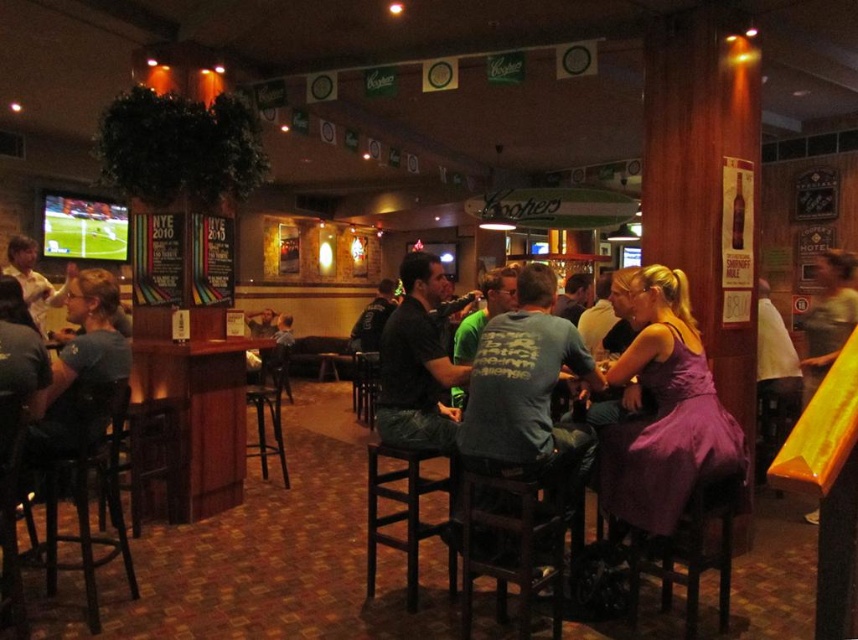
You are standing at the entrance of the bar and want to order a drink. The bartender is at the bar counter. Which direction should you walk to reach the bar counter? The objects you can see are the dark gray shirt at center represented by point (418, 362). Please answer based on the coordinate system where the entrance is at the bottom left corner of the image, and the coordinates are normalized between 0 and 1 in both x and y axes.

The dark gray shirt at center is located at point (418, 362). Since the entrance is at the bottom left corner, moving towards the bar counter would require walking towards the center of the image, which is where the dark gray shirt at center is positioned. Therefore, you should walk towards the upper right direction from the entrance.

You are a customer at the bar and want to sit on the black wooden bar stool at center. To your left, there is a yellow fabric at right. Which direction should you move to sit down?

The yellow fabric at right is to the right of the black wooden bar stool at center, so you should move to the left to sit on the black wooden bar stool at center.

You are a bartender standing behind the dark wood bar stool at center. You need to hand a drink to a customer wearing the purple satin dress at center. Can you reach them without moving from your current position?

The purple satin dress at center is in front of the dark wood bar stool at center, so yes, you can reach them without moving from your current position.